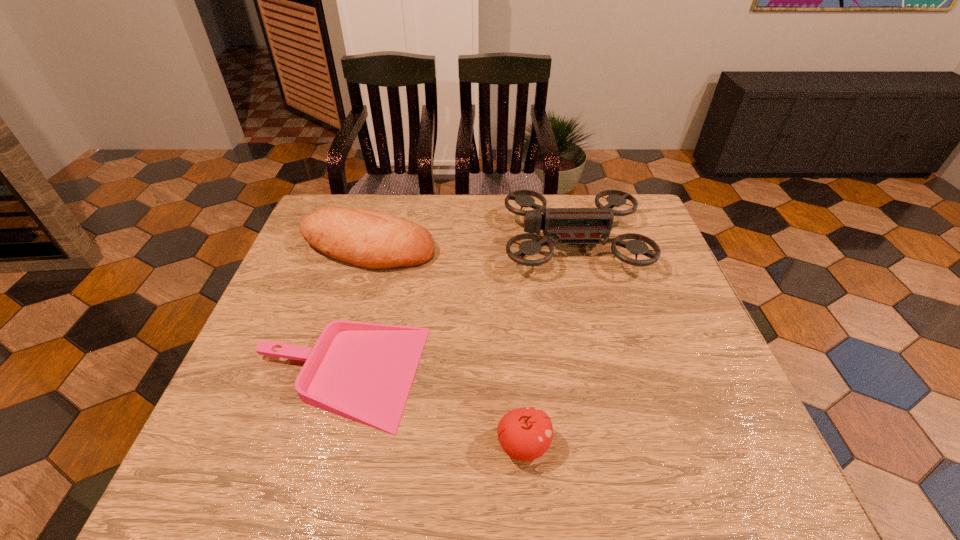
Identify the location of bread located in the far edge section of the desktop. This screenshot has height=540, width=960. (370, 239).

Image resolution: width=960 pixels, height=540 pixels. Identify the location of object located in the near edge section of the desktop. (525, 434).

The height and width of the screenshot is (540, 960). In order to click on bread located in the left edge section of the desktop in this screenshot , I will do `click(370, 239)`.

I want to click on dustpan present at the left edge, so click(361, 371).

The height and width of the screenshot is (540, 960). In order to click on object located in the right edge section of the desktop in this screenshot , I will do `click(573, 226)`.

Identify the location of object positioned at the far left corner. The image size is (960, 540). (370, 239).

The height and width of the screenshot is (540, 960). I want to click on object that is at the far right corner, so click(x=573, y=226).

What are the coordinates of `vacant region at the near edge` in the screenshot? It's located at (359, 448).

The image size is (960, 540). In the image, there is a desktop. Find the location of `vacant space at the left edge`. vacant space at the left edge is located at coordinates (244, 372).

The width and height of the screenshot is (960, 540). What are the coordinates of `free space at the right edge of the desktop` in the screenshot? It's located at (624, 272).